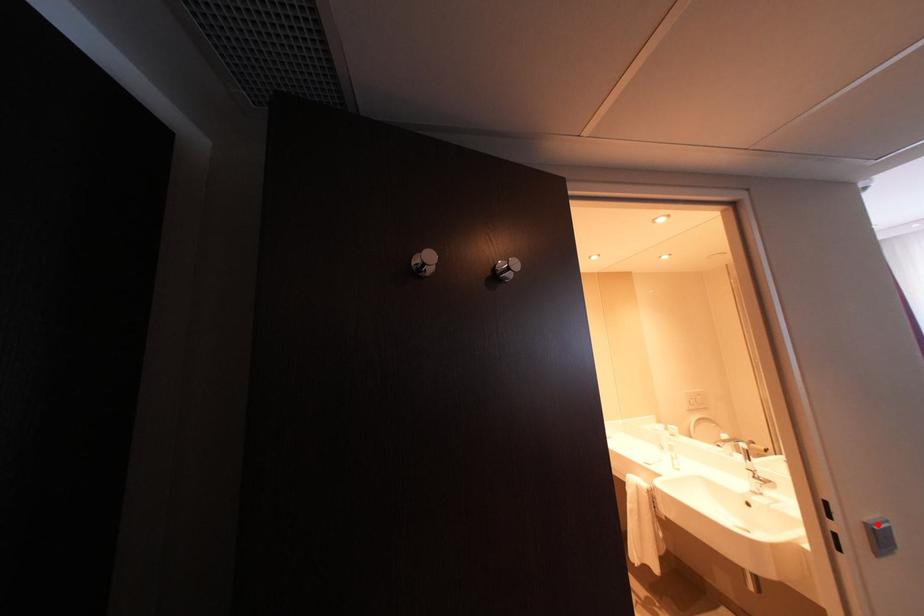
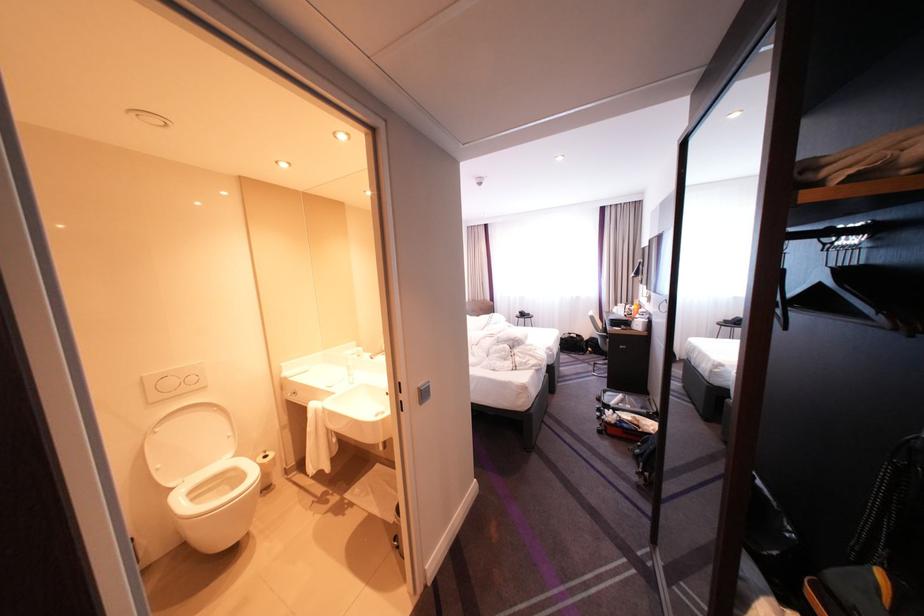
Where in the second image is the point corresponding to the highlighted location from the first image?

(430, 389)